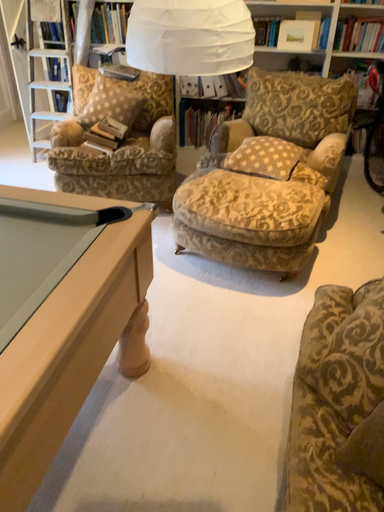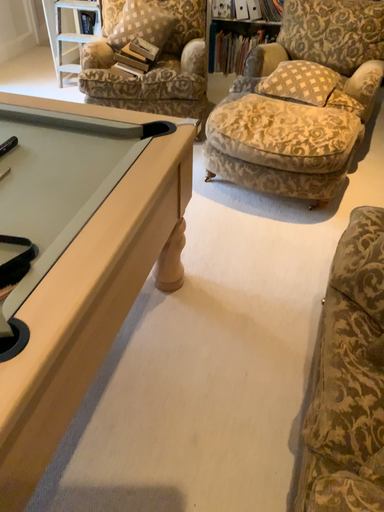
Question: Which way did the camera rotate in the video?

Choices:
 (A) rotated upward
 (B) rotated downward

Answer: (B)